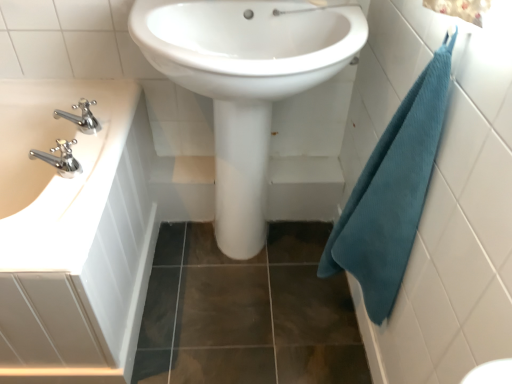
This screenshot has width=512, height=384. I want to click on spots to the right of chrome metallic faucet at left, so click(x=108, y=127).